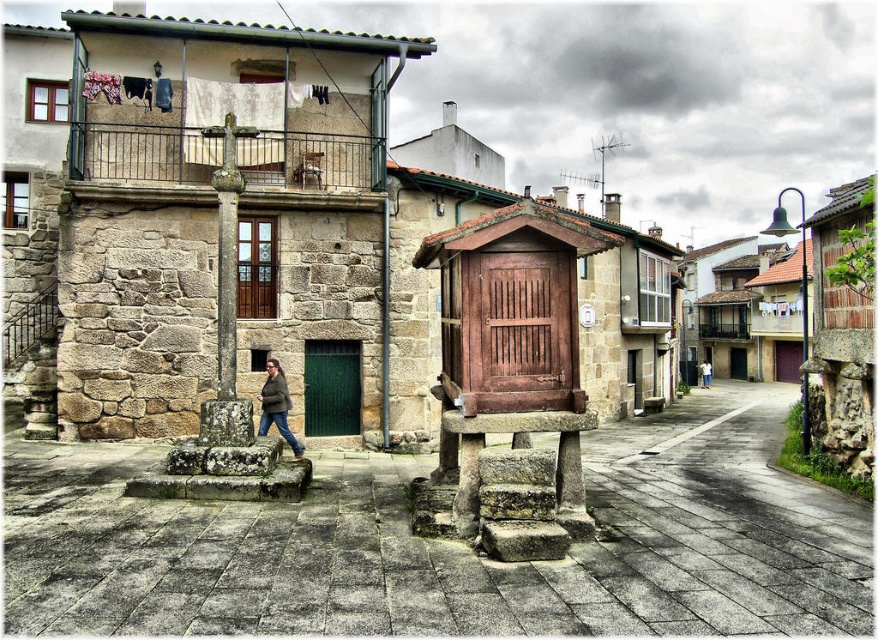
Question: Does stone alley at center appear on the left side of brown leather jacket at center?

Choices:
 (A) no
 (B) yes

Answer: (A)

Question: Is stone alley at center closer to camera compared to denim pants at center?

Choices:
 (A) yes
 (B) no

Answer: (A)

Question: Can you confirm if stone alley at center is thinner than brown leather jacket at center?

Choices:
 (A) no
 (B) yes

Answer: (A)

Question: Which of these objects is positioned farthest from the brown leather jacket at center?

Choices:
 (A) stone alley at center
 (B) denim pants at center

Answer: (B)

Question: Among these objects, which one is farthest from the camera?

Choices:
 (A) stone alley at center
 (B) denim pants at center

Answer: (B)

Question: Among these points, which one is farthest from the camera?

Choices:
 (A) (263, 397)
 (B) (583, 573)
 (C) (709, 381)

Answer: (C)